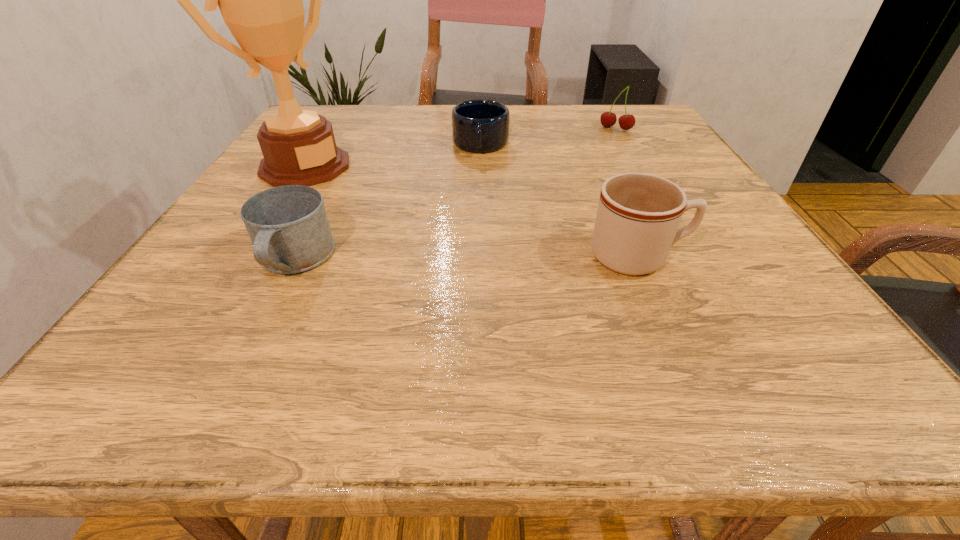
Locate an element on the screen. The width and height of the screenshot is (960, 540). vacant space on the desktop that is between the leftmost mug and the tallest mug and is positioned with the handle on the side of the farthest mug is located at coordinates (468, 259).

The width and height of the screenshot is (960, 540). I want to click on vacant spot on the desktop that is between the leftmost mug and the rightmost mug and is positioned on the surface of the cherry, so click(x=505, y=258).

You are a GUI agent. You are given a task and a screenshot of the screen. Output one action in this format:
    pyautogui.click(x=<x>, y=<y>)
    Task: Click on the free spot on the desktop that is between the leftmost mug and the rightmost mug and is positioned on the front-facing side of the tallest object
    This screenshot has height=540, width=960.
    Given the screenshot: What is the action you would take?
    pyautogui.click(x=468, y=259)